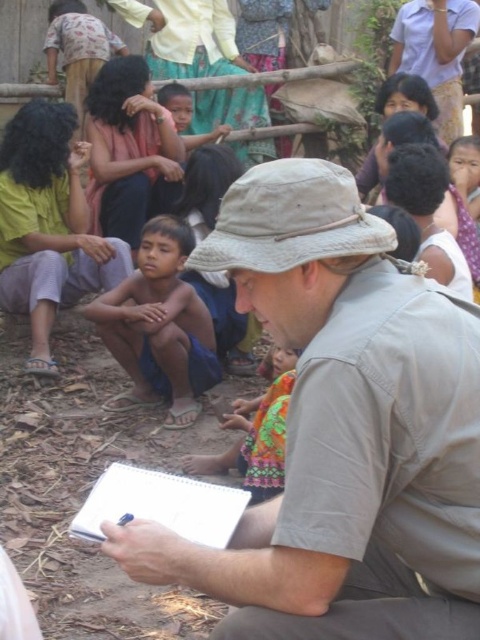
You are a photographer standing at the edge of the scene. You want to take a photo that includes both the tan fabric hat at center and the light green fabric shirt at lower left. Which object should you adjust your camera angle to focus on first to ensure both are in frame?

You should focus on the light green fabric shirt at lower left first because it is wider than the tan fabric hat at center, so ensuring it fits in the frame will automatically include the narrower hat.

You are a photographer trying to capture a clear shot of the tan fabric hat at center and the light green fabric shirt at lower left. Based on their heights, which object should you focus on first to ensure both are in frame?

The tan fabric hat at center is not as tall as the light green fabric shirt at lower left, so you should focus on the light green fabric shirt at lower left first to ensure both are in frame.

You are a photographer taking a picture of the man in the scene. The blue shorts at center and white paper clipboard at center are both in your view. Which object should you focus on first if you want to ensure both are in focus?

You should focus on the white paper clipboard at center first because it is closer to the camera than the blue shorts at center, which is above it and farther away. This ensures both will be in focus when using a single focal point.